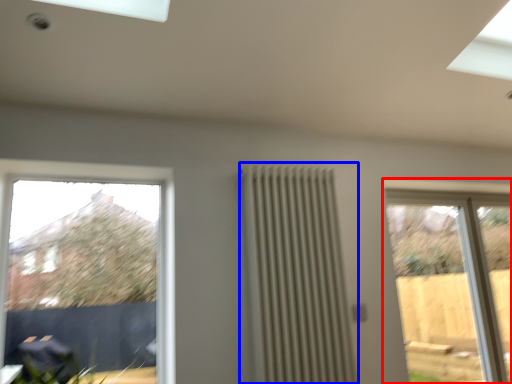
Question: Which point is further to the camera, window (highlighted by a red box) or radiator (highlighted by a blue box)?

Choices:
 (A) window
 (B) radiator

Answer: (A)